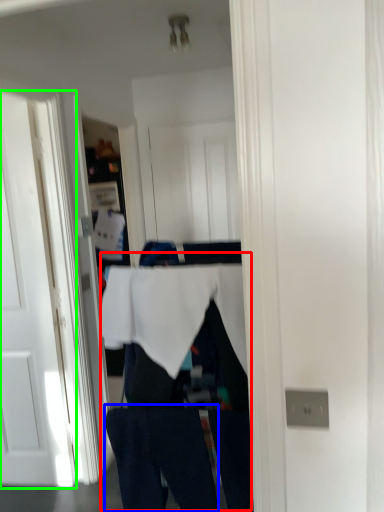
Question: Which object is positioned farthest from person (highlighted by a red box)? Select from jeans (highlighted by a blue box) and door (highlighted by a green box).

Choices:
 (A) jeans
 (B) door

Answer: (B)